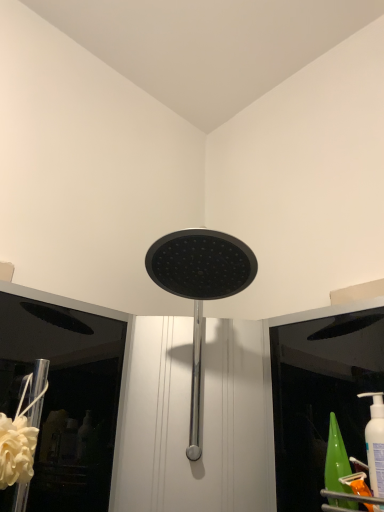
The height and width of the screenshot is (512, 384). Find the location of `white matte flower at lower left`. white matte flower at lower left is located at coordinates (16, 450).

What do you see at coordinates (16, 450) in the screenshot?
I see `white matte flower at lower left` at bounding box center [16, 450].

This screenshot has height=512, width=384. What do you see at coordinates (200, 289) in the screenshot? I see `black matte shower head at center` at bounding box center [200, 289].

The width and height of the screenshot is (384, 512). Find the location of `black matte shower head at center`. black matte shower head at center is located at coordinates coord(200,289).

This screenshot has height=512, width=384. What are the coordinates of `white matte flower at lower left` in the screenshot? It's located at (16, 450).

Is white matte flower at lower left to the left or to the right of black matte shower head at center in the image?

white matte flower at lower left is positioned on black matte shower head at center's left side.

Consider the image. Is the position of white matte flower at lower left more distant than that of black matte shower head at center?

Yes, the depth of white matte flower at lower left is greater than that of black matte shower head at center.

Between point (16, 481) and point (191, 229), which one is positioned in front?

Positioned in front is point (16, 481).

From the image's perspective, is white matte flower at lower left below black matte shower head at center?

Yes, from the image's perspective, white matte flower at lower left is beneath black matte shower head at center.

From a real-world perspective, is white matte flower at lower left beneath black matte shower head at center?

Correct, in the physical world, white matte flower at lower left is lower than black matte shower head at center.

Which object is thinner, white matte flower at lower left or black matte shower head at center?

white matte flower at lower left.

Does white matte flower at lower left have a greater height compared to black matte shower head at center?

In fact, white matte flower at lower left may be shorter than black matte shower head at center.

Does white matte flower at lower left have a smaller size compared to black matte shower head at center?

Yes, white matte flower at lower left is smaller than black matte shower head at center.

Choose the correct answer: Is white matte flower at lower left inside black matte shower head at center or outside it?

white matte flower at lower left is not inside black matte shower head at center, it's outside.

Would you consider white matte flower at lower left to be distant from black matte shower head at center?

Actually, white matte flower at lower left and black matte shower head at center are a little close together.

Is white matte flower at lower left aimed at black matte shower head at center?

No, white matte flower at lower left is not turned towards black matte shower head at center.

Find the location of `shower on the right side of white matte flower at lower left`. shower on the right side of white matte flower at lower left is located at coordinates (200, 289).

Which object is positioned more to the right, black matte shower head at center or white matte flower at lower left?

black matte shower head at center is more to the right.

Does black matte shower head at center lie in front of white matte flower at lower left?

Yes, black matte shower head at center is closer to the camera.

Does point (193, 274) appear closer or farther from the camera than point (27, 455)?

Point (193, 274) is positioned farther from the camera compared to point (27, 455).

From the image's perspective, between black matte shower head at center and white matte flower at lower left, which one is located above?

black matte shower head at center.

From a real-world perspective, which object stands above the other?

black matte shower head at center is physically above.

Considering the relative sizes of black matte shower head at center and white matte flower at lower left in the image provided, is black matte shower head at center wider than white matte flower at lower left?

Yes.

Considering the sizes of objects black matte shower head at center and white matte flower at lower left in the image provided, who is shorter, black matte shower head at center or white matte flower at lower left?

white matte flower at lower left.

Considering the sizes of objects black matte shower head at center and white matte flower at lower left in the image provided, who is bigger, black matte shower head at center or white matte flower at lower left?

black matte shower head at center is bigger.

Which is correct: black matte shower head at center is inside white matte flower at lower left, or outside of it?

black matte shower head at center is outside white matte flower at lower left.

Is there a large distance between black matte shower head at center and white matte flower at lower left?

black matte shower head at center is near white matte flower at lower left, not far away.

Consider the image. Is black matte shower head at center facing towards white matte flower at lower left?

No, black matte shower head at center is not facing towards white matte flower at lower left.

What's the angular difference between black matte shower head at center and white matte flower at lower left's facing directions?

46.9 degrees separate the facing orientations of black matte shower head at center and white matte flower at lower left.

How far apart are black matte shower head at center and white matte flower at lower left?

black matte shower head at center is 34.64 centimeters from white matte flower at lower left.

What are the coordinates of `shower on the right of white matte flower at lower left` in the screenshot? It's located at (200, 289).

This screenshot has height=512, width=384. In order to click on shower in front of the white matte flower at lower left in this screenshot , I will do `click(200, 289)`.

This screenshot has width=384, height=512. I want to click on shower above the white matte flower at lower left (from the image's perspective), so (x=200, y=289).